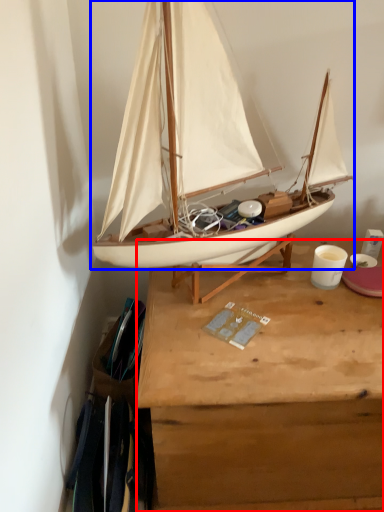
Question: Which point is closer to the camera, desk (highlighted by a red box) or boat (highlighted by a blue box)?

Choices:
 (A) desk
 (B) boat

Answer: (B)